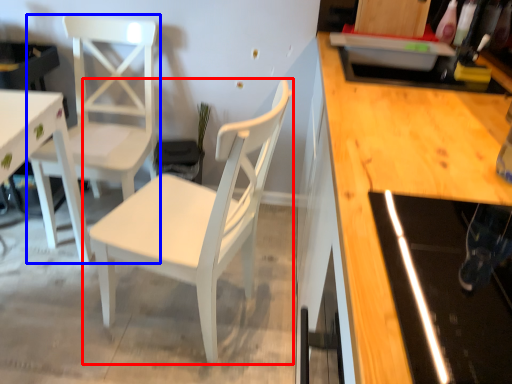
Question: Among these objects, which one is nearest to the camera, chair (highlighted by a red box) or chair (highlighted by a blue box)?

Choices:
 (A) chair
 (B) chair

Answer: (A)